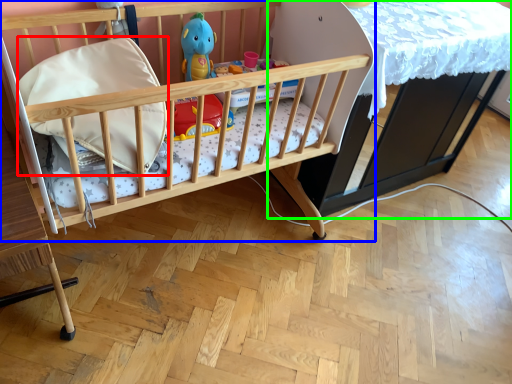
Question: Considering the real-world distances, which object is farthest from pillow (highlighted by a red box)? infant bed (highlighted by a blue box) or table (highlighted by a green box)?

Choices:
 (A) infant bed
 (B) table

Answer: (B)